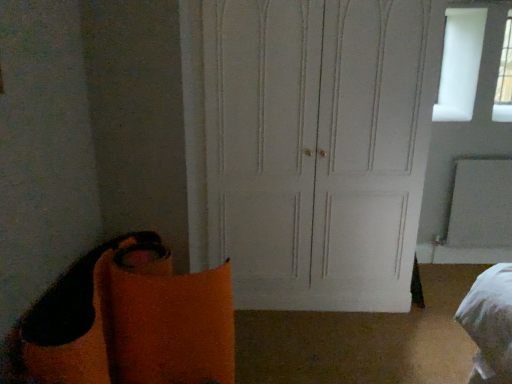
Question: From the image's perspective, relative to transparent glass window at upper right, is white matte door at center above or below?

Choices:
 (A) above
 (B) below

Answer: (B)

Question: From their relative heights in the image, would you say white matte door at center is taller or shorter than transparent glass window at upper right?

Choices:
 (A) tall
 (B) short

Answer: (A)

Question: From a real-world perspective, is white matte door at center physically located above or below transparent glass window at upper right?

Choices:
 (A) above
 (B) below

Answer: (B)

Question: From a real-world perspective, is transparent glass window at upper right physically located above or below white matte door at center?

Choices:
 (A) below
 (B) above

Answer: (B)

Question: Do you think transparent glass window at upper right is within white matte door at center, or outside of it?

Choices:
 (A) outside
 (B) inside

Answer: (A)

Question: Considering their positions, is transparent glass window at upper right located in front of or behind white matte door at center?

Choices:
 (A) behind
 (B) front

Answer: (A)

Question: Is transparent glass window at upper right taller or shorter than white matte door at center?

Choices:
 (A) short
 (B) tall

Answer: (A)